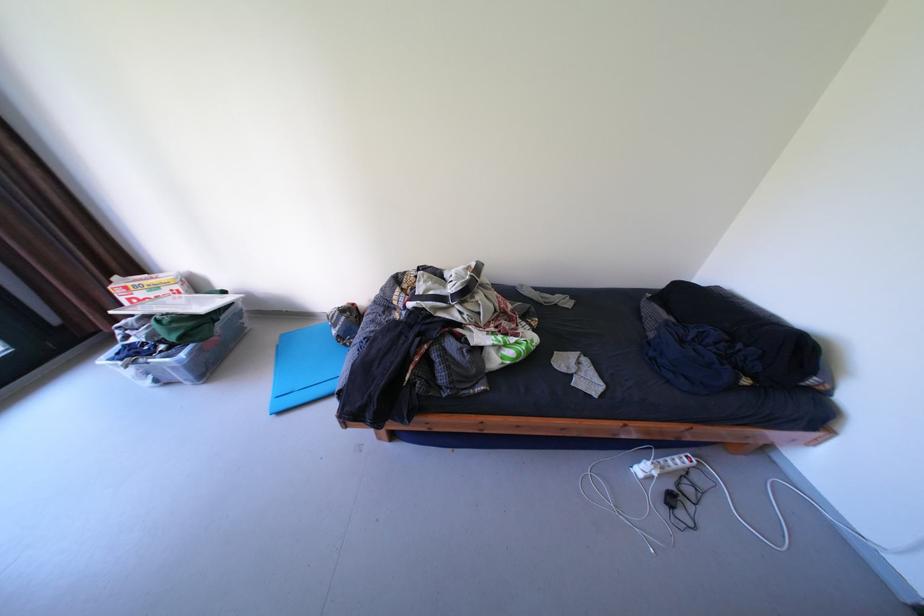
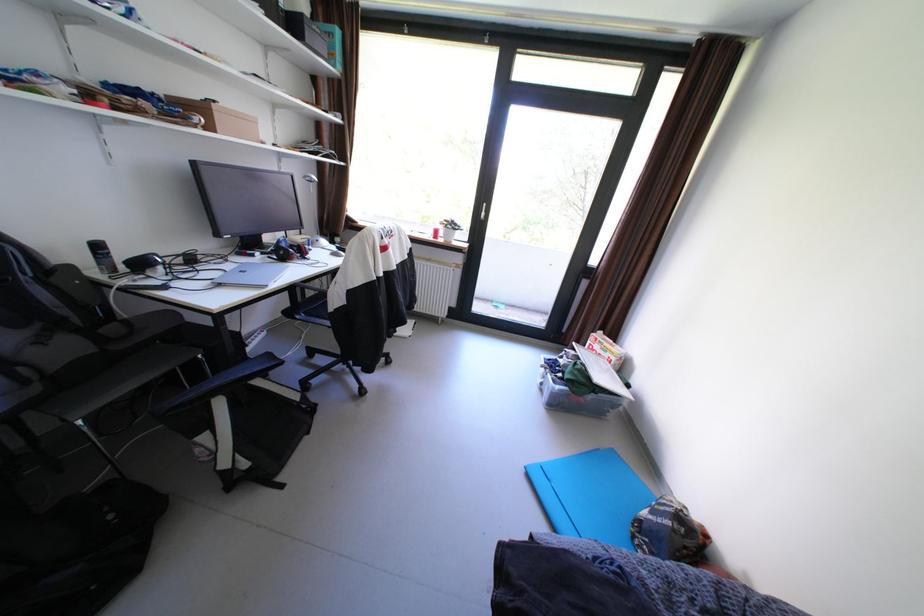
In the second image, find the point that corresponds to point 284,358 in the first image.

(594, 450)